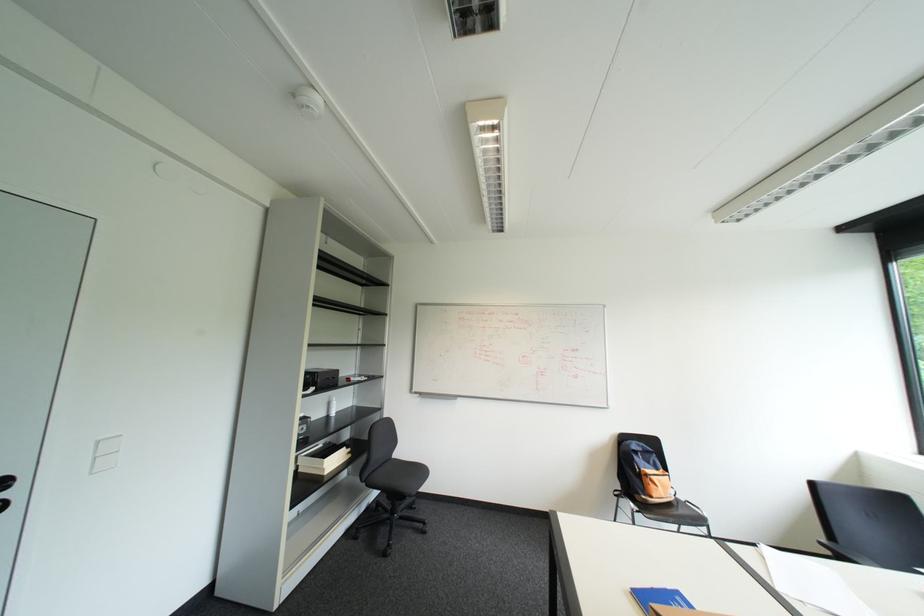
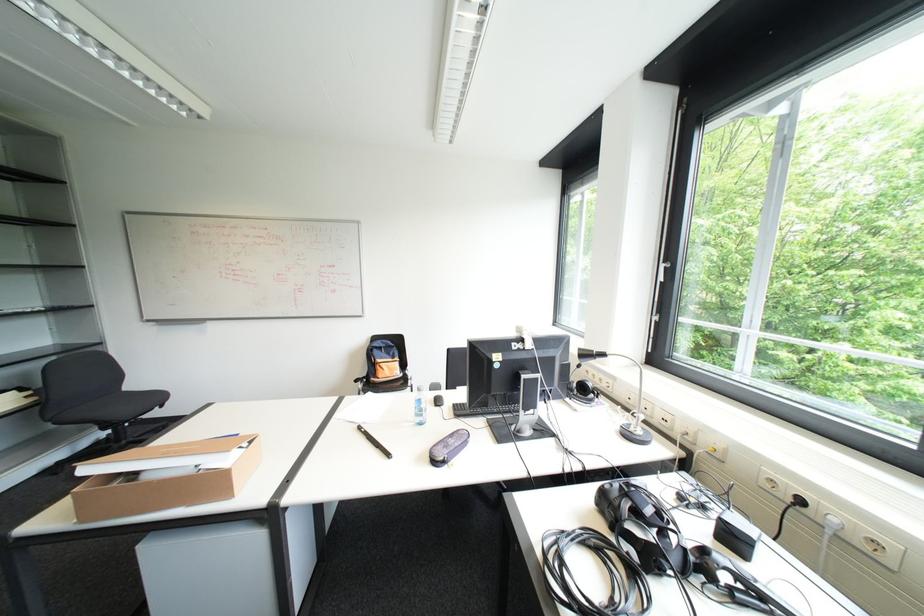
Question: In a continuous first-person perspective shot, in which direction is the camera moving?

Choices:
 (A) Left
 (B) Right
 (C) Forward
 (D) Backward

Answer: (B)